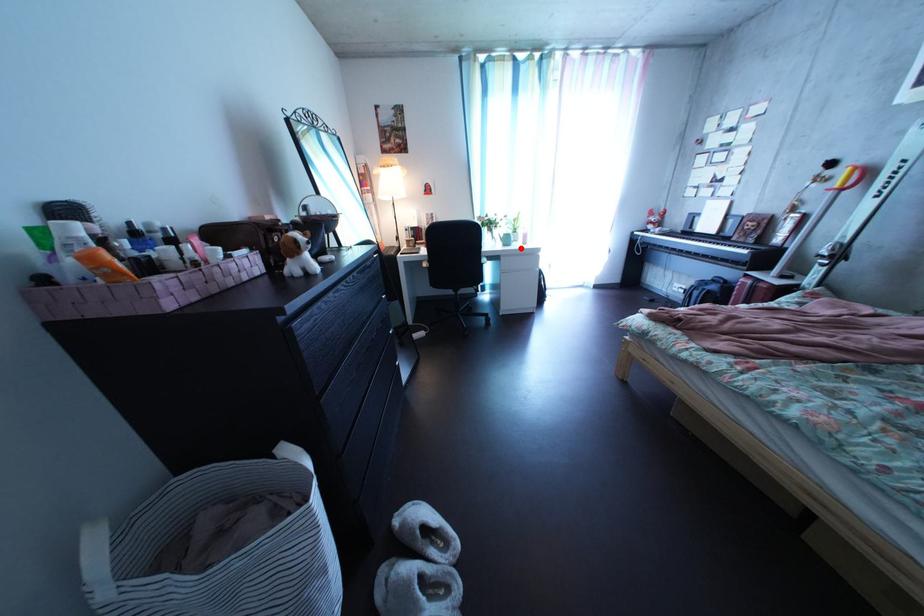
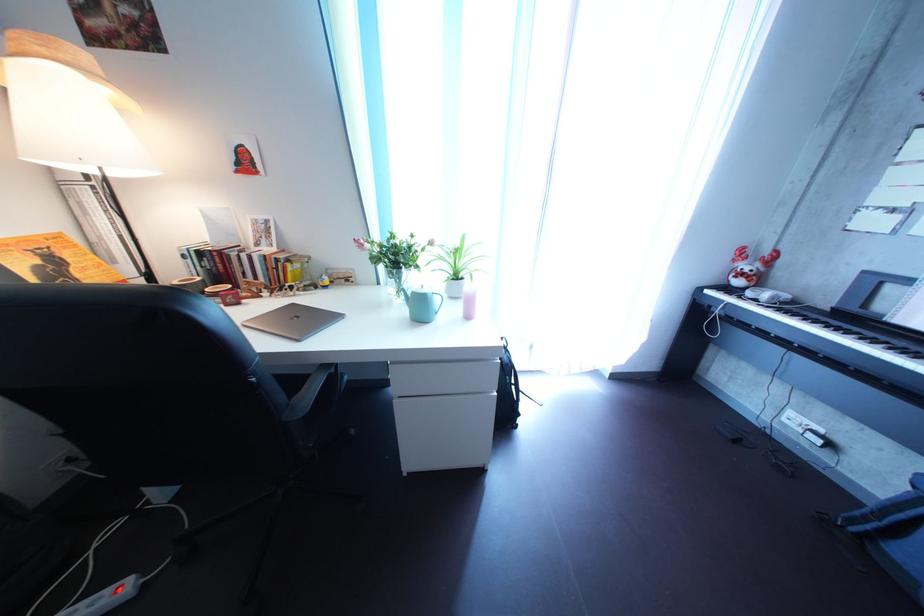
Question: I am providing you with two images of the same scene from different viewpoints. A red point is shown in image1. For the corresponding object point in image2, is it positioned nearer or farther from the camera?

Choices:
 (A) Nearer
 (B) Farther

Answer: (B)